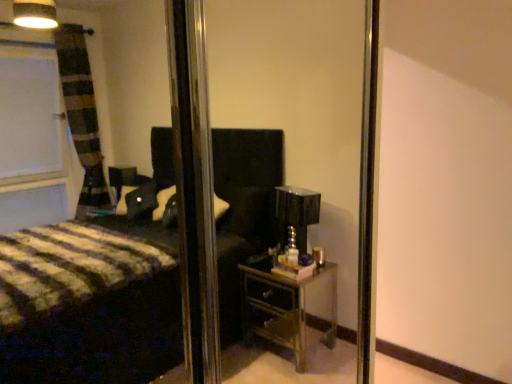
Find the location of a particular element. The image size is (512, 384). metallic black screen door at center is located at coordinates (194, 186).

What is the approximate width of metallic black screen door at center?

The width of metallic black screen door at center is 4.27 inches.

This screenshot has height=384, width=512. Describe the element at coordinates (194, 186) in the screenshot. I see `metallic black screen door at center` at that location.

You are a GUI agent. You are given a task and a screenshot of the screen. Output one action in this format:
    pyautogui.click(x=<x>, y=<y>)
    Task: Click on the metallic black screen door at center
    The width and height of the screenshot is (512, 384).
    Given the screenshot: What is the action you would take?
    tap(194, 186)